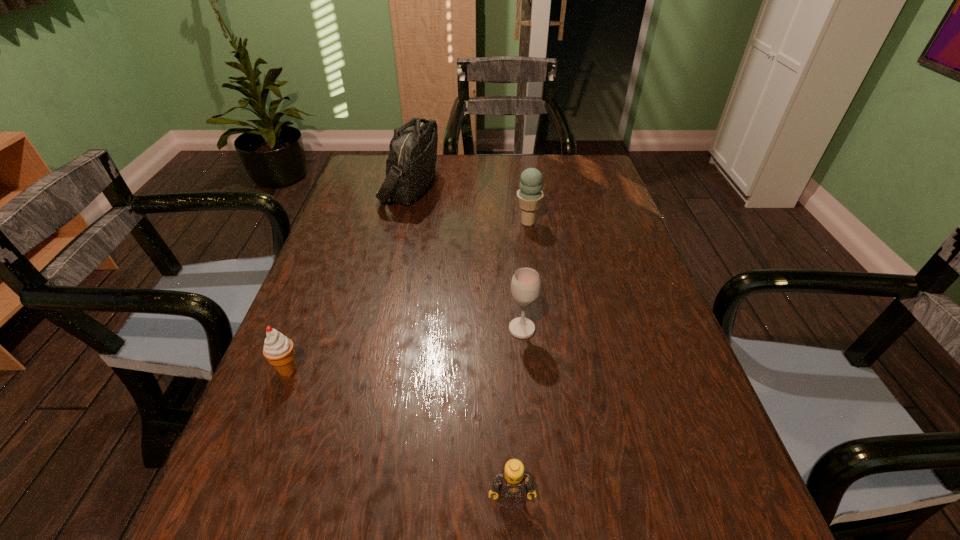
Locate an element on the screen. vacant space located on the back of the third nearest object is located at coordinates 516,256.

The width and height of the screenshot is (960, 540). Find the location of `vacant space located on the back of the shorter icecream`. vacant space located on the back of the shorter icecream is located at coordinates (339, 239).

Image resolution: width=960 pixels, height=540 pixels. I want to click on object at the far edge, so click(410, 166).

The image size is (960, 540). Identify the location of shoulder bag present at the left edge. (410, 166).

At what (x,y) coordinates should I click in order to perform the action: click on icecream that is at the left edge. Please return your answer as a coordinate pair (x, y). Looking at the image, I should click on (278, 349).

Locate an element on the screen. object that is at the far left corner is located at coordinates (410, 166).

At what (x,y) coordinates should I click in order to perform the action: click on vacant space at the far edge. Please return your answer as a coordinate pair (x, y). Looking at the image, I should click on (491, 158).

Image resolution: width=960 pixels, height=540 pixels. What are the coordinates of `vacant space at the left edge of the desktop` in the screenshot? It's located at (261, 403).

In order to click on free space at the right edge of the desktop in this screenshot , I will do `click(606, 228)`.

Where is `free spot at the far right corner of the desktop`? This screenshot has width=960, height=540. free spot at the far right corner of the desktop is located at coordinates (574, 181).